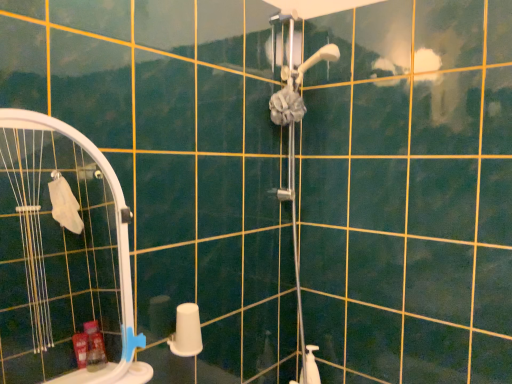
Question: Considering the relative sizes of white matte toilet paper at lower center and white plastic screen door at left in the image provided, is white matte toilet paper at lower center taller than white plastic screen door at left?

Choices:
 (A) yes
 (B) no

Answer: (B)

Question: Is white matte toilet paper at lower center positioned before white plastic screen door at left?

Choices:
 (A) yes
 (B) no

Answer: (B)

Question: Can white plastic screen door at left be found inside white matte toilet paper at lower center?

Choices:
 (A) no
 (B) yes

Answer: (A)

Question: Does white matte toilet paper at lower center have a larger size compared to white plastic screen door at left?

Choices:
 (A) no
 (B) yes

Answer: (A)

Question: From the image's perspective, is white matte toilet paper at lower center under white plastic screen door at left?

Choices:
 (A) no
 (B) yes

Answer: (B)

Question: Considering the positions of blue plastic towel bar at lower left and white plastic screen door at left in the image, is blue plastic towel bar at lower left bigger or smaller than white plastic screen door at left?

Choices:
 (A) small
 (B) big

Answer: (A)

Question: Considering their positions, is blue plastic towel bar at lower left located in front of or behind white plastic screen door at left?

Choices:
 (A) behind
 (B) front

Answer: (A)

Question: Considering the relative positions of blue plastic towel bar at lower left and white plastic screen door at left in the image provided, is blue plastic towel bar at lower left to the left or to the right of white plastic screen door at left?

Choices:
 (A) right
 (B) left

Answer: (A)

Question: From a real-world perspective, is blue plastic towel bar at lower left positioned above or below white plastic screen door at left?

Choices:
 (A) below
 (B) above

Answer: (A)

Question: Looking at their shapes, would you say blue plastic towel bar at lower left is wider or thinner than white matte toilet paper at lower center?

Choices:
 (A) wide
 (B) thin

Answer: (B)

Question: From a real-world perspective, is blue plastic towel bar at lower left above or below white matte toilet paper at lower center?

Choices:
 (A) below
 (B) above

Answer: (B)

Question: Based on their positions, is blue plastic towel bar at lower left located to the left or right of white matte toilet paper at lower center?

Choices:
 (A) left
 (B) right

Answer: (A)

Question: Considering the positions of point (138, 342) and point (198, 314), is point (138, 342) closer or farther from the camera than point (198, 314)?

Choices:
 (A) farther
 (B) closer

Answer: (B)

Question: Considering the relative positions of white matte toilet paper at lower center and white plastic screen door at left in the image provided, is white matte toilet paper at lower center to the left or to the right of white plastic screen door at left?

Choices:
 (A) right
 (B) left

Answer: (A)

Question: From a real-world perspective, relative to white plastic screen door at left, is white matte toilet paper at lower center vertically above or below?

Choices:
 (A) below
 (B) above

Answer: (A)